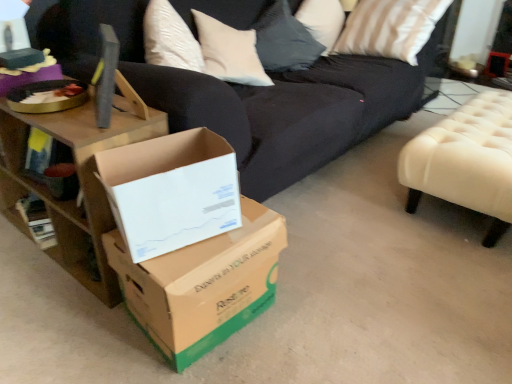
Question: Is metallic silver side table at upper right not within white cardboard box at center, placed as the first box when sorted from top to bottom?

Choices:
 (A) no
 (B) yes

Answer: (B)

Question: Would you consider metallic silver side table at upper right to be distant from white cardboard box at center, placed as the first box when sorted from top to bottom?

Choices:
 (A) yes
 (B) no

Answer: (A)

Question: From the image's perspective, is metallic silver side table at upper right located beneath white cardboard box at center, which is the 2th box in bottom-to-top order?

Choices:
 (A) no
 (B) yes

Answer: (A)

Question: Is metallic silver side table at upper right facing towards white cardboard box at center, which is the 2th box in bottom-to-top order?

Choices:
 (A) no
 (B) yes

Answer: (A)

Question: Considering the relative positions of metallic silver side table at upper right and white cardboard box at center, which is the 2th box in bottom-to-top order, in the image provided, is metallic silver side table at upper right to the right of white cardboard box at center, which is the 2th box in bottom-to-top order, from the viewer's perspective?

Choices:
 (A) no
 (B) yes

Answer: (B)

Question: Is metallic silver side table at upper right shorter than white cardboard box at center, which is the 2th box in bottom-to-top order?

Choices:
 (A) yes
 (B) no

Answer: (A)

Question: Can you confirm if white tufted ottoman at right is smaller than metallic silver side table at upper right?

Choices:
 (A) no
 (B) yes

Answer: (A)

Question: Is white tufted ottoman at right outside of metallic silver side table at upper right?

Choices:
 (A) yes
 (B) no

Answer: (A)

Question: Is white tufted ottoman at right bigger than metallic silver side table at upper right?

Choices:
 (A) no
 (B) yes

Answer: (B)

Question: From the image's perspective, is white tufted ottoman at right over metallic silver side table at upper right?

Choices:
 (A) no
 (B) yes

Answer: (A)

Question: Considering the relative sizes of white tufted ottoman at right and metallic silver side table at upper right in the image provided, is white tufted ottoman at right wider than metallic silver side table at upper right?

Choices:
 (A) yes
 (B) no

Answer: (A)

Question: Is white tufted ottoman at right at the right side of metallic silver side table at upper right?

Choices:
 (A) yes
 (B) no

Answer: (B)

Question: Can you confirm if white cardboard box at center, placed as the first box when sorted from top to bottom, is smaller than wooden table at left?

Choices:
 (A) no
 (B) yes

Answer: (B)